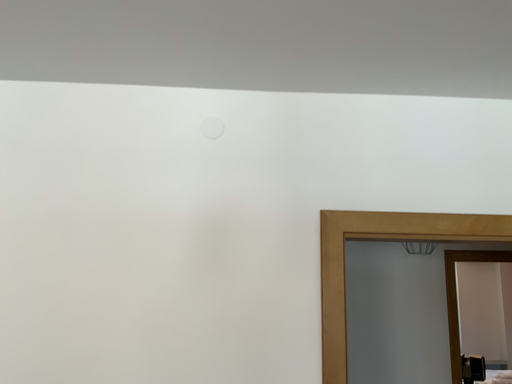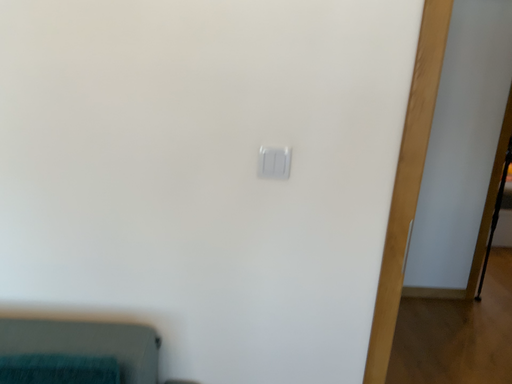
Question: Which way did the camera rotate in the video?

Choices:
 (A) rotated upward
 (B) rotated downward

Answer: (B)